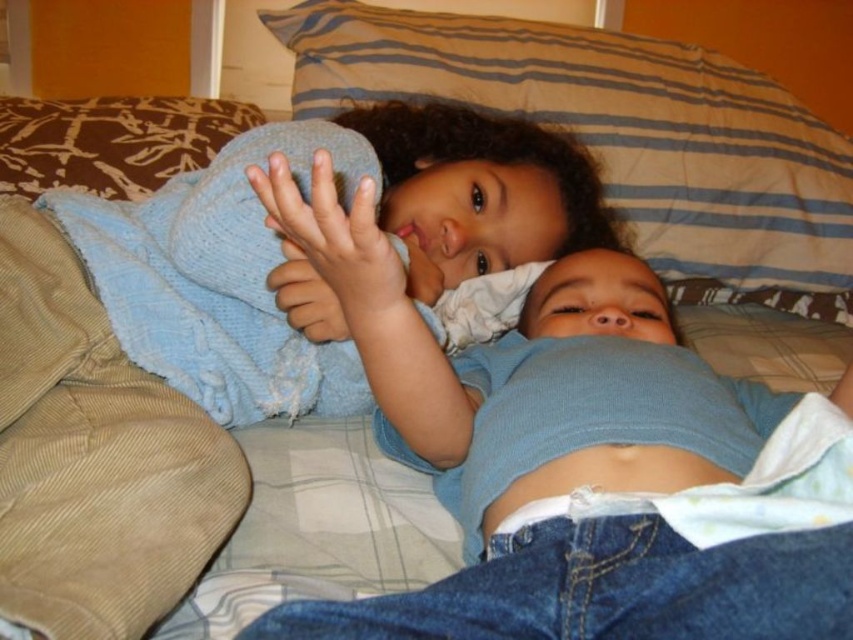
You are a photographer setting up a shoot in the bedroom scene described. You need to ensure that the blue cotton shirt at center and the striped fabric pillow at upper center are both visible in the frame. Given their relative heights, which object should you position closer to the camera to ensure both are fully visible?

The blue cotton shirt at center has a lesser height compared to the striped fabric pillow at upper center. To ensure both are fully visible, position the blue cotton shirt at center closer to the camera since it is shorter and might be partially obscured by the taller pillow if placed farther back.

You are a photographer setting up for a family photo shoot in the bedroom. You need to place a 15 cm tall decoration between the striped fabric pillow at upper center and the brown textured pillow at upper left. Will the decoration fit vertically between them?

The striped fabric pillow at upper center is much taller than the brown textured pillow at upper left. Since the decoration is only 15 cm tall, it should fit vertically between them as long as the vertical space between the pillows accommodates the height of the decoration.